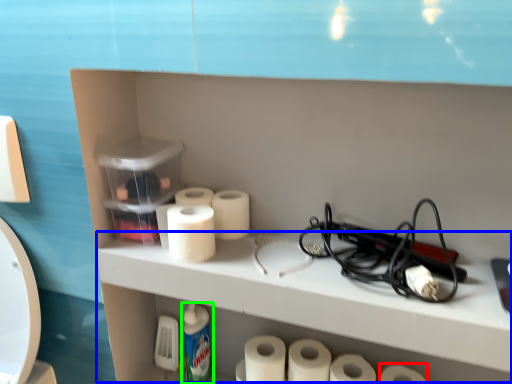
Question: Which is nearer to the toilet paper (highlighted by a red box)? counter (highlighted by a blue box) or cleaning product (highlighted by a green box).

Choices:
 (A) counter
 (B) cleaning product

Answer: (A)